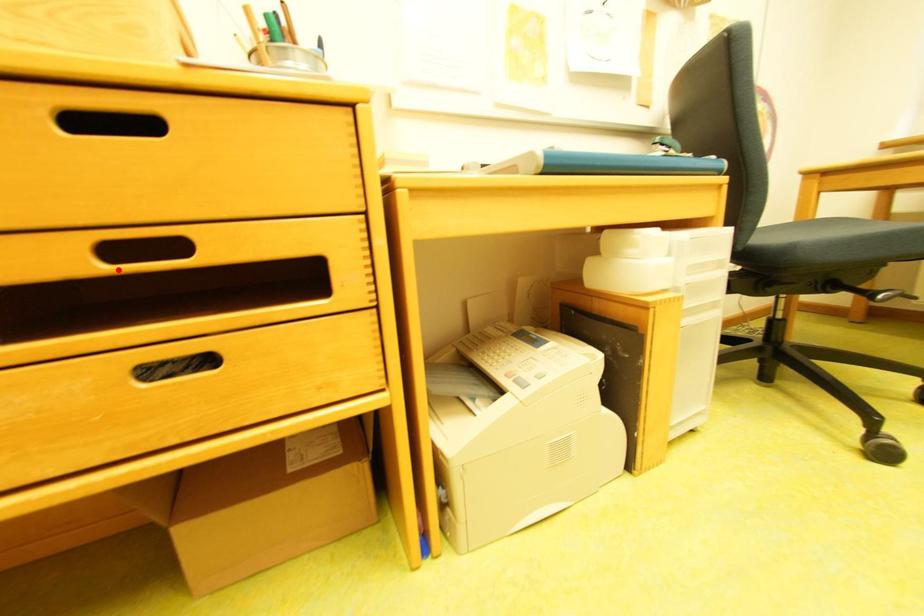
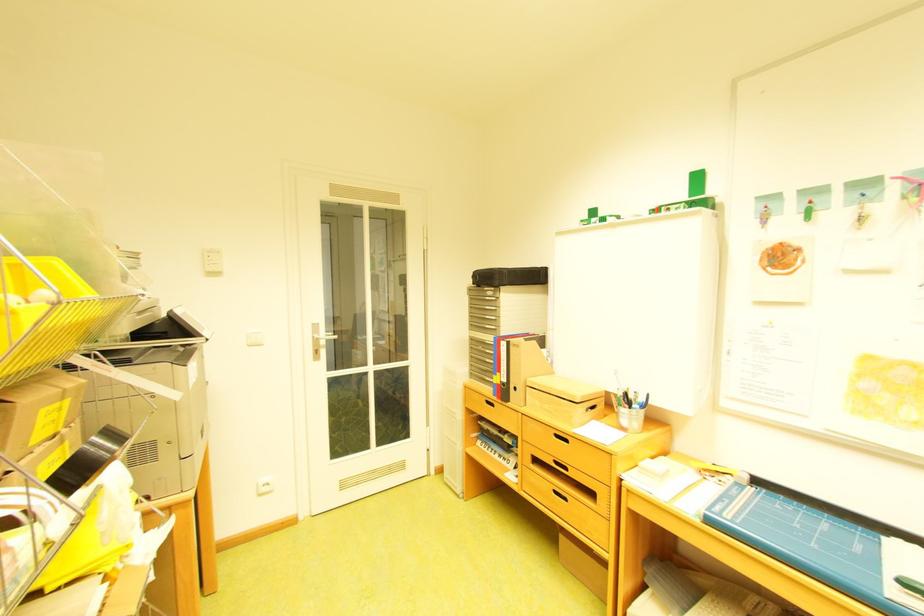
Question: I am providing you with two images of the same scene from different viewpoints. Image1 has a red point marked. In image2, the corresponding 3D location appears at what relative position? Reply with the corresponding letter.

Choices:
 (A) Closer
 (B) Farther

Answer: (B)